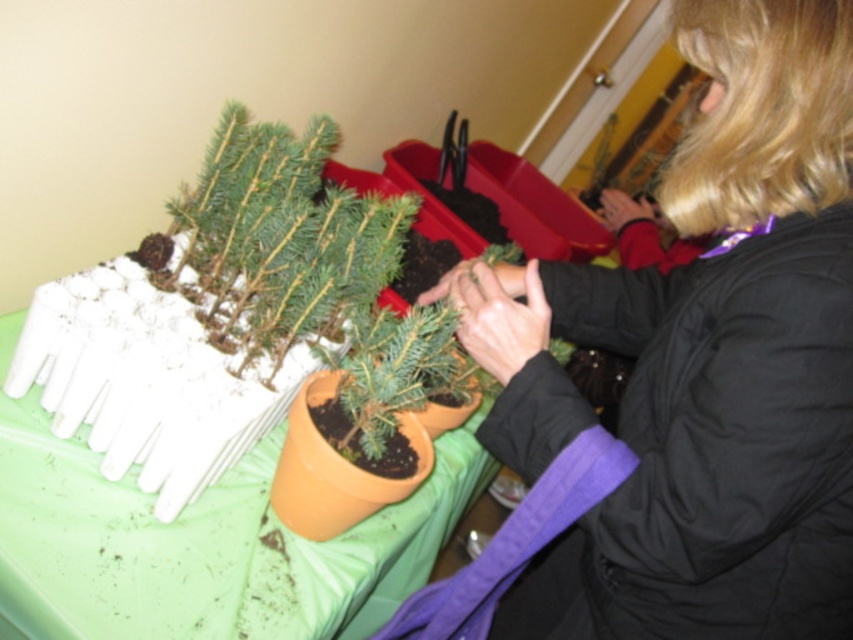
Question: Among these points, which one is nearest to the camera?

Choices:
 (A) (430, 509)
 (B) (668, 202)

Answer: (B)

Question: Does black jacket at center have a larger size compared to green fabric tablecloth at lower left?

Choices:
 (A) yes
 (B) no

Answer: (B)

Question: Can you confirm if black jacket at center is bigger than green fabric tablecloth at lower left?

Choices:
 (A) no
 (B) yes

Answer: (A)

Question: Which of the following is the farthest from the observer?

Choices:
 (A) (44, 516)
 (B) (607, 292)

Answer: (B)

Question: Which object appears closest to the camera in this image?

Choices:
 (A) black jacket at center
 (B) green fabric tablecloth at lower left

Answer: (A)

Question: Does black jacket at center have a larger size compared to green fabric tablecloth at lower left?

Choices:
 (A) yes
 (B) no

Answer: (B)